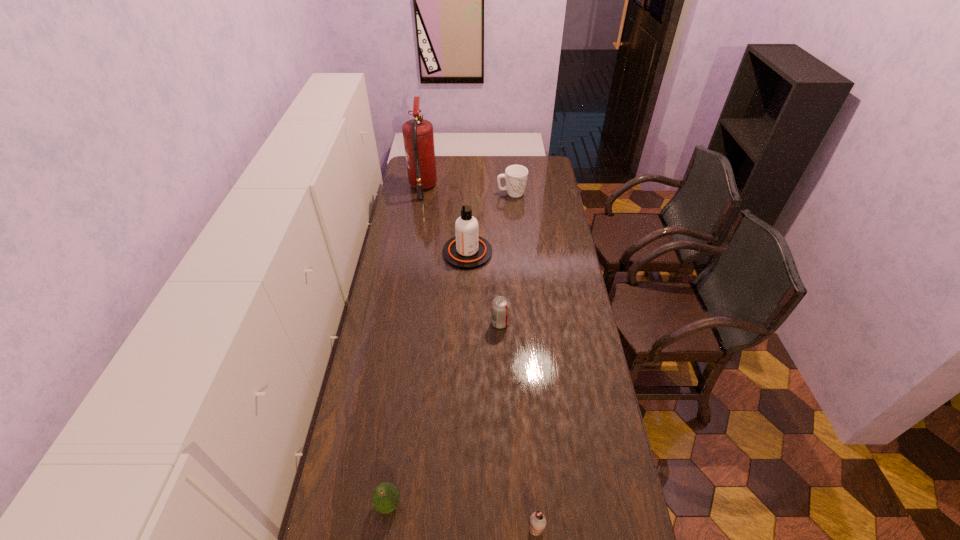
You are a GUI agent. You are given a task and a screenshot of the screen. Output one action in this format:
    pyautogui.click(x=<x>, y=<y>)
    Task: Click on the vacant space located 0.100m on the left of the fourth farthest object
    The height and width of the screenshot is (540, 960).
    Given the screenshot: What is the action you would take?
    pyautogui.click(x=466, y=323)

The image size is (960, 540). What are the coordinates of `free space located 0.280m on the left of the nearest object` in the screenshot? It's located at (427, 529).

In order to click on free spot located on the right of the avocado in this screenshot , I will do `click(429, 504)`.

The width and height of the screenshot is (960, 540). Find the location of `object positioned at the far edge`. object positioned at the far edge is located at coordinates (418, 136).

You are a GUI agent. You are given a task and a screenshot of the screen. Output one action in this format:
    pyautogui.click(x=<x>, y=<y>)
    Task: Click on the fire extinguisher present at the left edge
    This screenshot has width=960, height=540.
    Given the screenshot: What is the action you would take?
    pyautogui.click(x=418, y=136)

Locate an element on the screen. This screenshot has height=540, width=960. avocado situated at the left edge is located at coordinates (385, 498).

Where is `object positioned at the far left corner`? object positioned at the far left corner is located at coordinates (418, 136).

You are a GUI agent. You are given a task and a screenshot of the screen. Output one action in this format:
    pyautogui.click(x=<x>, y=<y>)
    Task: Click on the free region at the far edge of the desktop
    This screenshot has height=540, width=960.
    Given the screenshot: What is the action you would take?
    pyautogui.click(x=456, y=177)

The image size is (960, 540). In the image, there is a desktop. Identify the location of vacant space at the left edge. point(405,350).

I want to click on vacant space at the right edge of the desktop, so click(553, 300).